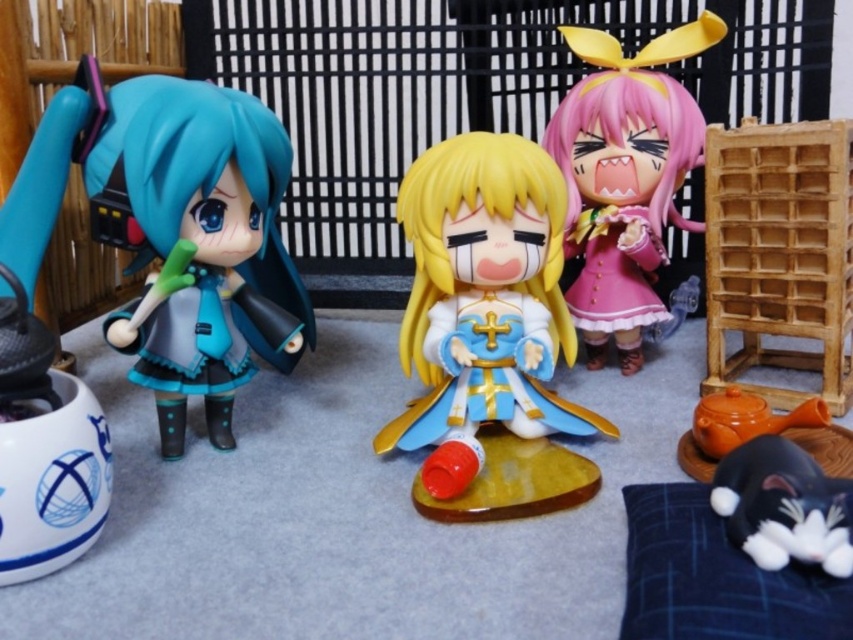
Question: Does matte black doll at left appear under pink matte plush at center?

Choices:
 (A) yes
 (B) no

Answer: (A)

Question: Among these points, which one is nearest to the camera?

Choices:
 (A) (144, 131)
 (B) (751, 484)
 (C) (567, 186)

Answer: (B)

Question: Which of the following is the closest to the observer?

Choices:
 (A) (165, 172)
 (B) (584, 227)
 (C) (747, 540)
 (D) (473, 273)

Answer: (C)

Question: Which point appears farthest from the camera in this image?

Choices:
 (A) 183,216
 (B) 480,502
 (C) 772,516

Answer: (A)

Question: Does pink matte plush at center have a smaller size compared to black glossy plush toy at lower right?

Choices:
 (A) yes
 (B) no

Answer: (B)

Question: Considering the relative positions of shiny plastic figure at center and black glossy plush toy at lower right in the image provided, where is shiny plastic figure at center located with respect to black glossy plush toy at lower right?

Choices:
 (A) right
 (B) left

Answer: (B)